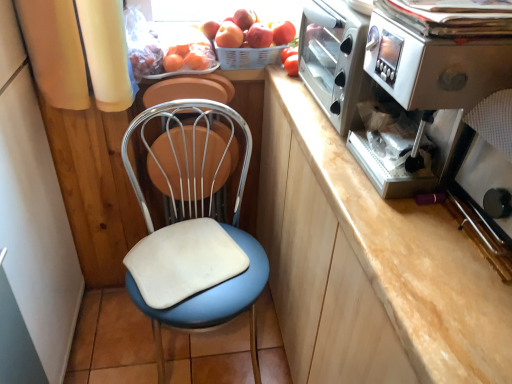
Identify the location of free location above plastic basket at upper center (from a real-world perspective). (252, 46).